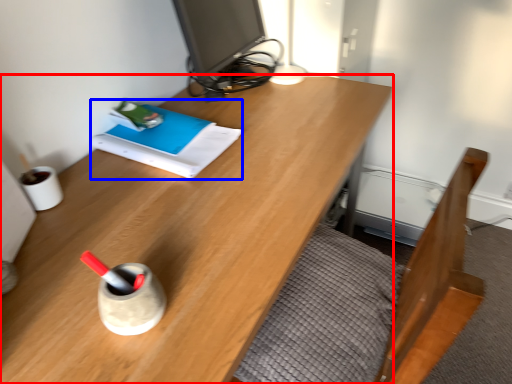
Question: Which object is further to the camera taking this photo, desk (highlighted by a red box) or book (highlighted by a blue box)?

Choices:
 (A) desk
 (B) book

Answer: (B)